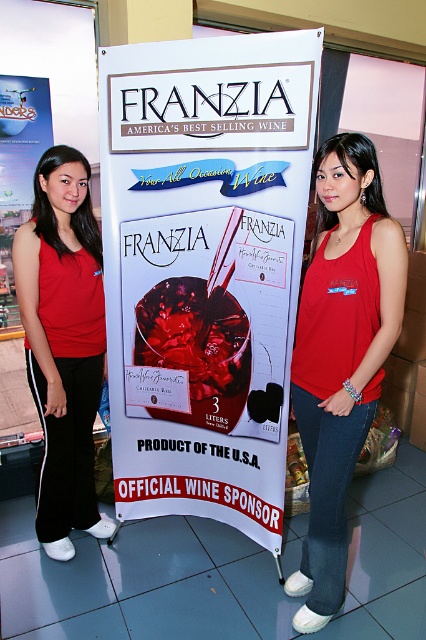
Question: Where is white paper poster at center located in relation to red tank top at center in the image?

Choices:
 (A) right
 (B) left

Answer: (B)

Question: Considering the relative positions of white paper poster at center and red tank top at center in the image provided, where is white paper poster at center located with respect to red tank top at center?

Choices:
 (A) right
 (B) left

Answer: (B)

Question: Which point appears farthest from the camera in this image?

Choices:
 (A) (244, 172)
 (B) (37, 308)

Answer: (B)

Question: Does red tank top at center have a smaller size compared to matte red tank top at center?

Choices:
 (A) yes
 (B) no

Answer: (B)

Question: Which point appears closest to the camera in this image?

Choices:
 (A) (65, 324)
 (B) (325, 317)

Answer: (B)

Question: Which point appears farthest from the camera in this image?

Choices:
 (A) (238, 108)
 (B) (78, 324)
 (C) (299, 330)

Answer: (B)